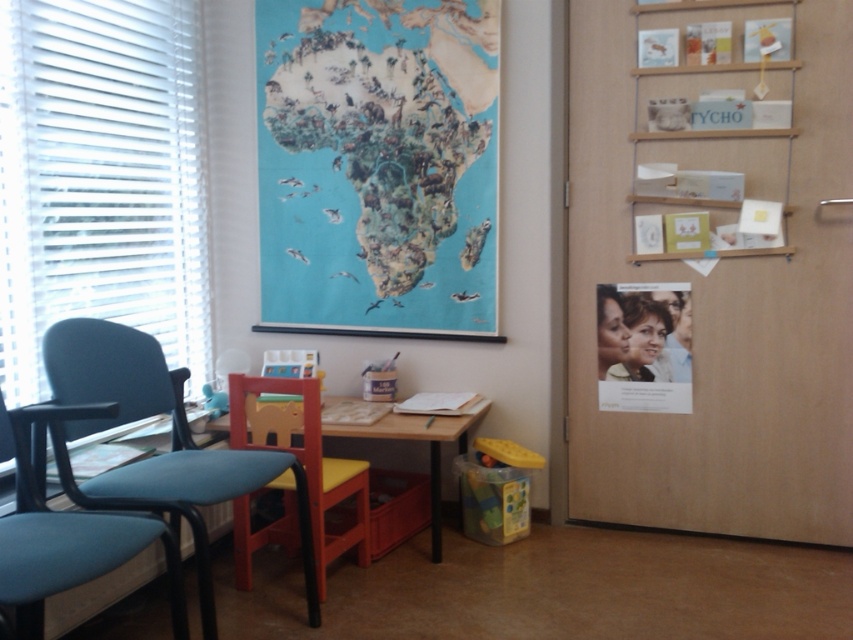
Can you confirm if matte paper poster at upper right is thinner than wooden table at center?

Yes, matte paper poster at upper right is thinner than wooden table at center.

Can you confirm if matte paper poster at upper right is wider than wooden table at center?

No.

Who is more distant from viewer, (657, 291) or (235, 536)?

Point (657, 291)

Find the location of a particular element. The image size is (853, 640). matte paper poster at upper right is located at coordinates (643, 346).

From the picture: Does blue paper map at upper center have a greater height compared to teal fabric swivel chair at left?

Indeed, blue paper map at upper center has a greater height compared to teal fabric swivel chair at left.

What do you see at coordinates (378, 164) in the screenshot?
I see `blue paper map at upper center` at bounding box center [378, 164].

Is point (479, 22) closer to viewer compared to point (28, 492)?

No.

You are a GUI agent. You are given a task and a screenshot of the screen. Output one action in this format:
    pyautogui.click(x=<x>, y=<y>)
    Task: Click on the blue paper map at upper center
    The image size is (853, 640).
    Given the screenshot: What is the action you would take?
    pyautogui.click(x=378, y=164)

Between wooden shelves at right and blue paper map at upper center, which one appears on the left side from the viewer's perspective?

blue paper map at upper center is more to the left.

Is wooden shelves at right above blue paper map at upper center?

No.

Who is more distant from viewer, (592, 12) or (404, 188)?

The point (404, 188) is more distant.

In order to click on wooden shelves at right in this screenshot , I will do `click(718, 285)`.